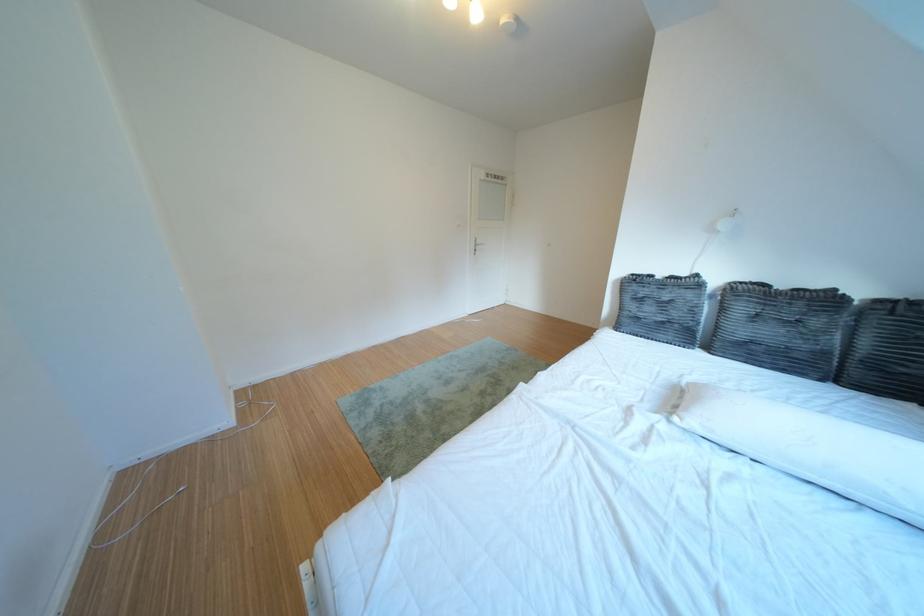
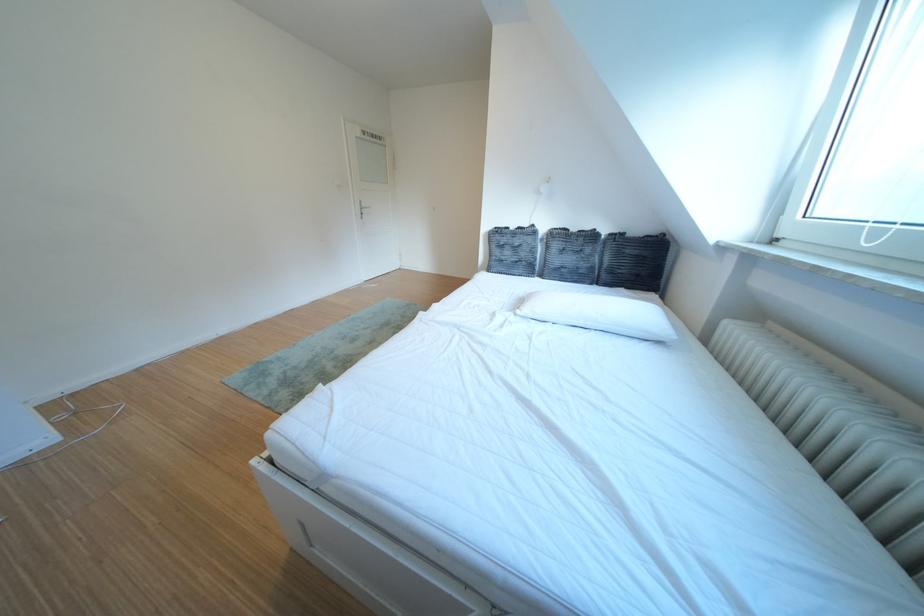
Question: In a continuous first-person perspective shot, in which direction is the camera moving?

Choices:
 (A) Left
 (B) Right
 (C) Forward
 (D) Backward

Answer: (D)